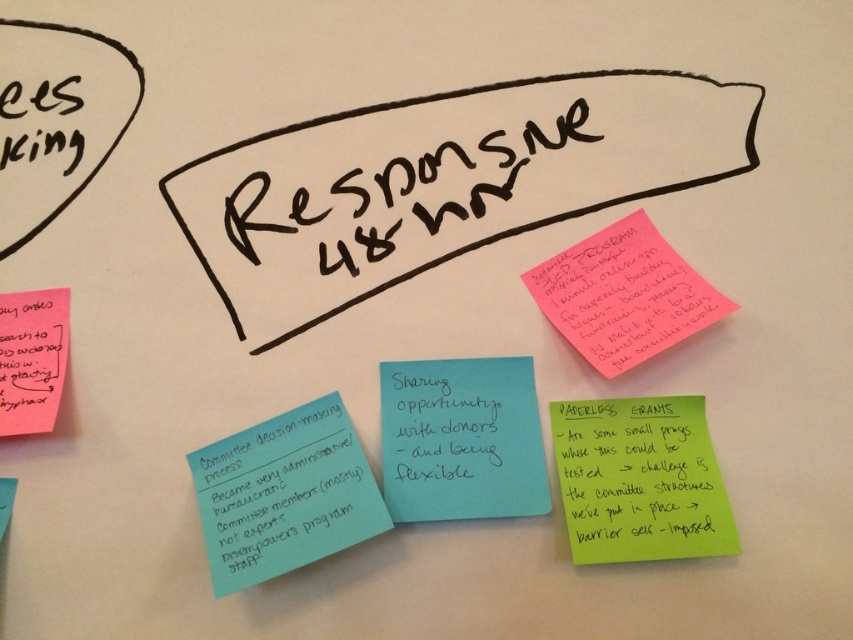
Which is behind, point (695, 416) or point (3, 346)?

Positioned behind is point (3, 346).

Does green paper at lower right have a smaller size compared to pink paper at lower left?

Incorrect, green paper at lower right is not smaller in size than pink paper at lower left.

The width and height of the screenshot is (853, 640). Identify the location of green paper at lower right. (639, 481).

Locate an element on the screen. green paper at lower right is located at coordinates (639, 481).

Is point (305, 124) farther from camera compared to point (408, 483)?

Yes.

In the scene shown: Can you confirm if black marker text on white paper at center is smaller than blue paper at center?

Actually, black marker text on white paper at center might be larger than blue paper at center.

Is point (680, 140) positioned behind point (474, 388)?

That is True.

Locate an element on the screen. black marker text on white paper at center is located at coordinates (444, 182).

Which is more to the right, black marker text on white paper at center or teal paper note at center-left?

From the viewer's perspective, black marker text on white paper at center appears more on the right side.

Does black marker text on white paper at center appear on the left side of teal paper note at center-left?

No, black marker text on white paper at center is not to the left of teal paper note at center-left.

Is point (219, 240) farther from camera compared to point (309, 525)?

Yes.

Identify the location of black marker text on white paper at center. This screenshot has width=853, height=640. (444, 182).